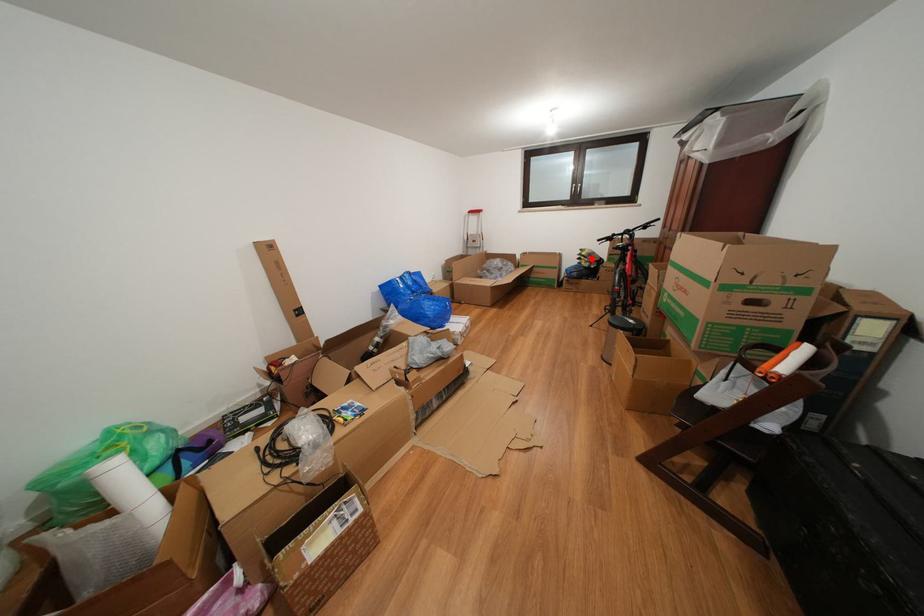
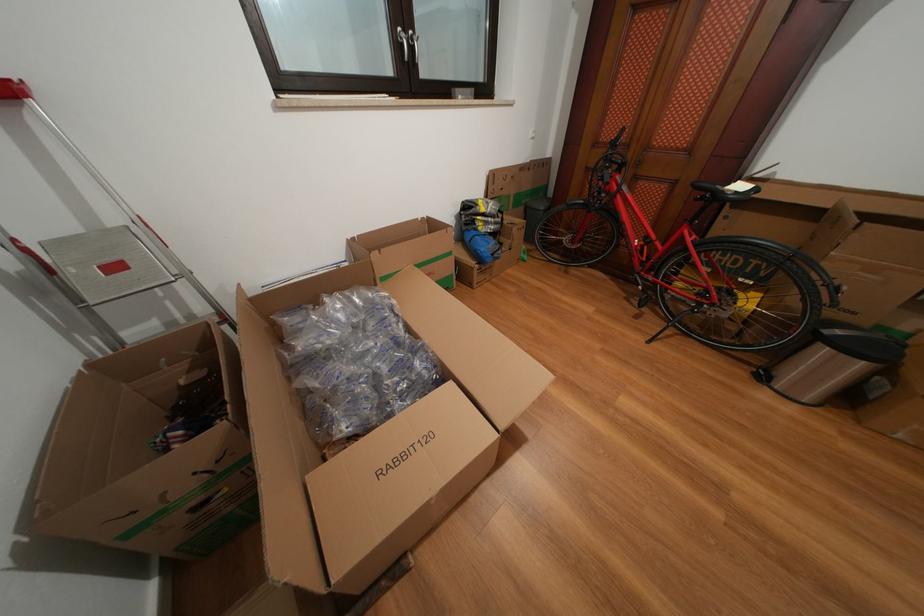
Where in the second image is the point corresponding to the highlighted location from the first image?

(491, 215)